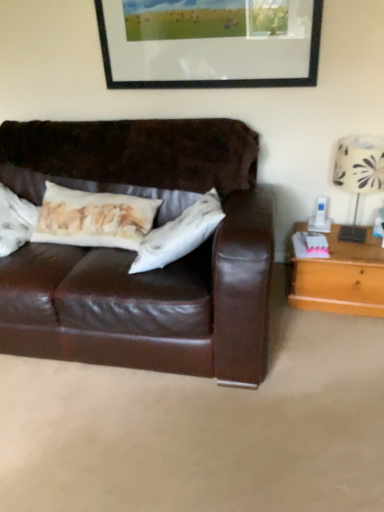
At what (x,y) coordinates should I click in order to perform the action: click on free space in front of light brown wooden table at right. Please return your answer as a coordinate pair (x, y). Looking at the image, I should click on (342, 338).